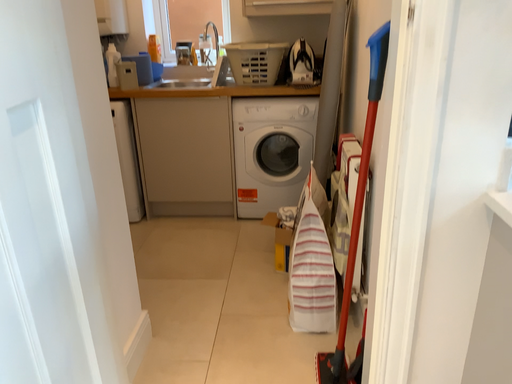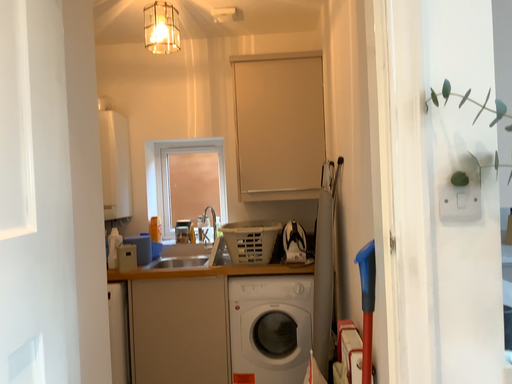
Question: Which way did the camera rotate in the video?

Choices:
 (A) rotated downward
 (B) rotated upward

Answer: (B)